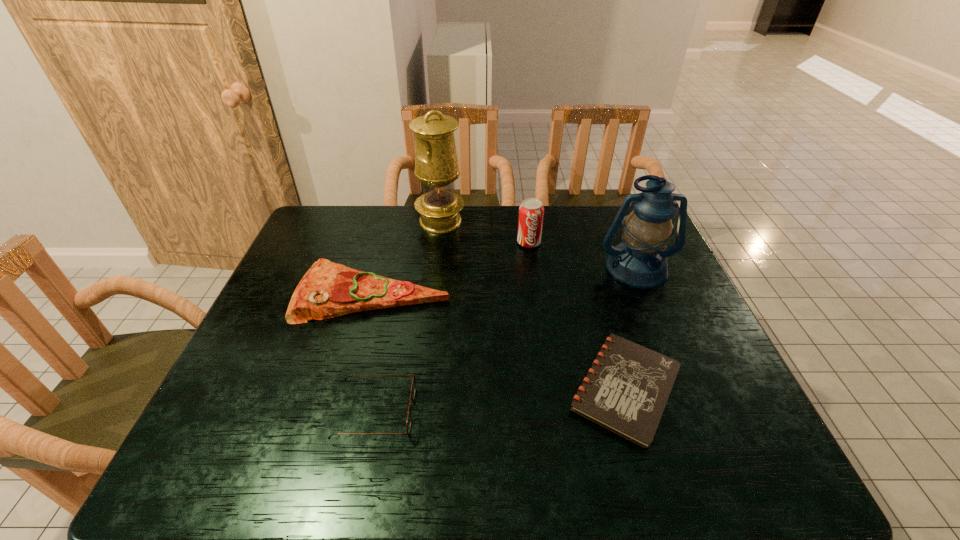
The image size is (960, 540). Identify the location of vacant region at the far edge. (426, 244).

Locate an element on the screen. vacant space at the near edge is located at coordinates (596, 464).

Image resolution: width=960 pixels, height=540 pixels. In the image, there is a desktop. In order to click on free space at the left edge in this screenshot , I will do `click(280, 301)`.

Locate an element on the screen. free region at the right edge of the desktop is located at coordinates (667, 287).

In the image, there is a desktop. Identify the location of vacant space at the far left corner. This screenshot has width=960, height=540. (317, 207).

This screenshot has height=540, width=960. Identify the location of vacant space that is in between the notebook and the pizza. (499, 341).

I want to click on empty space between the pizza and the third tallest object, so click(451, 268).

Identify the location of free space between the fifth shortest object and the pizza. This screenshot has height=540, width=960. (505, 281).

I want to click on free space between the pizza and the notebook, so click(x=499, y=341).

You are a GUI agent. You are given a task and a screenshot of the screen. Output one action in this format:
    pyautogui.click(x=<x>, y=<y>)
    Task: Click on the empty location between the oil lamp and the soda can
    The height and width of the screenshot is (540, 960).
    Given the screenshot: What is the action you would take?
    [x=485, y=232]